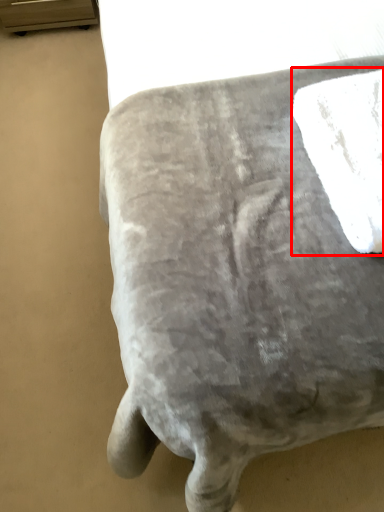
Question: From the image's perspective, where is bath towel (annotated by the red box) located in relation to furniture in the image?

Choices:
 (A) above
 (B) below

Answer: (B)